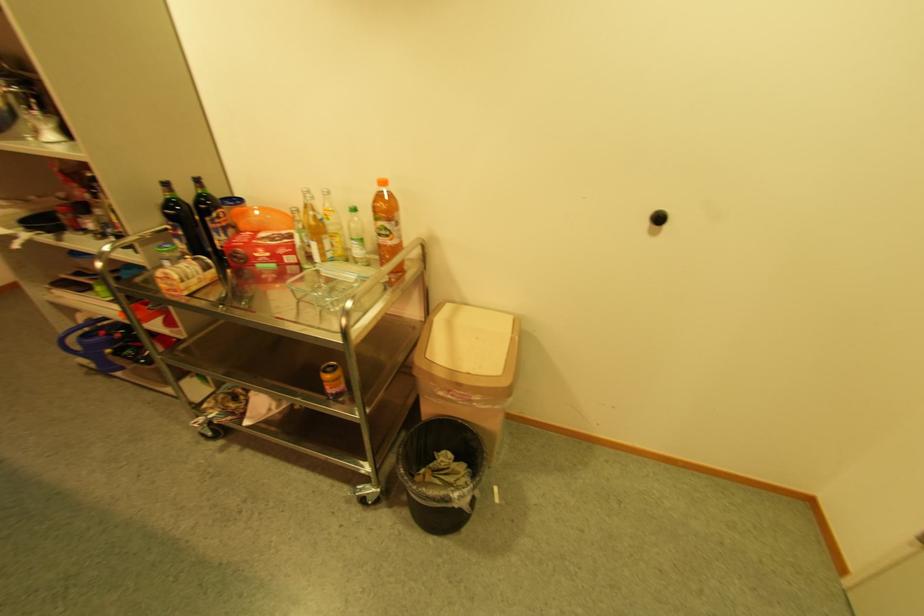
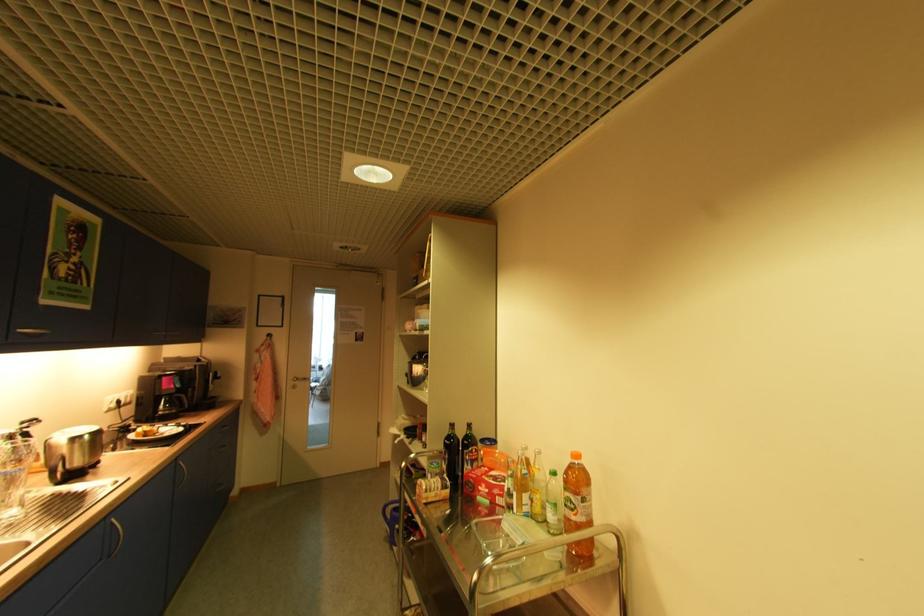
Find the pixel in the second image that matches point 278,267 in the first image.

(492, 503)